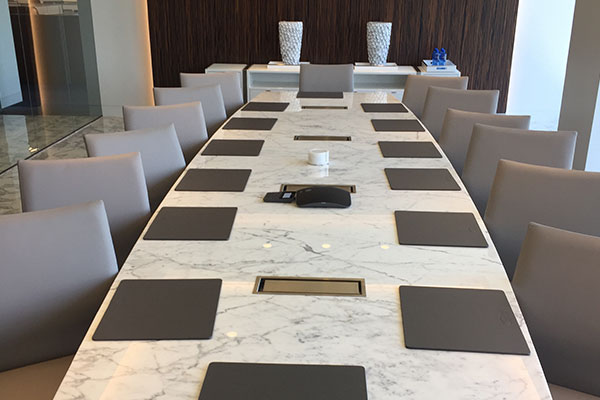
Locate an element on the screen. This screenshot has width=600, height=400. table white with grey streaks is located at coordinates (313, 335), (328, 244), (347, 162), (343, 113).